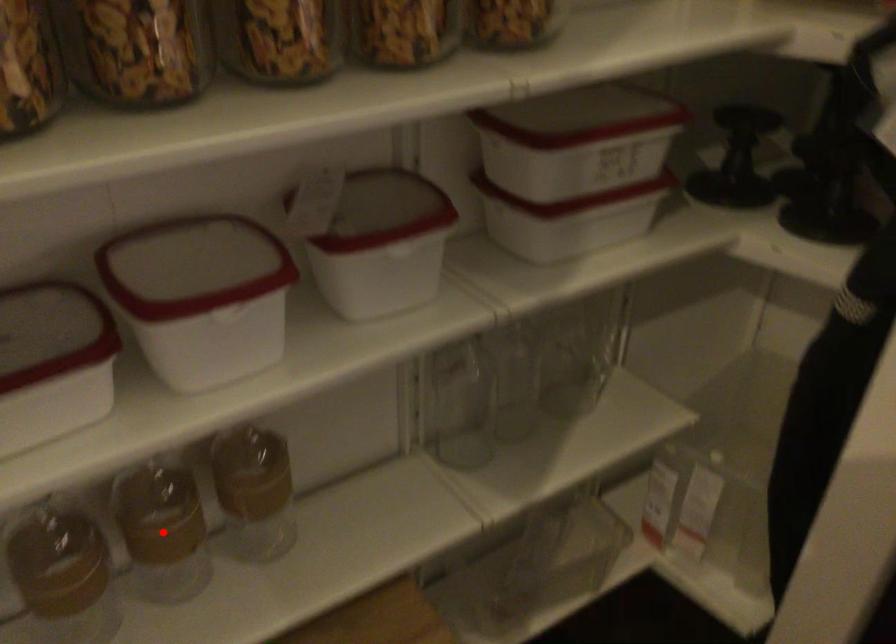
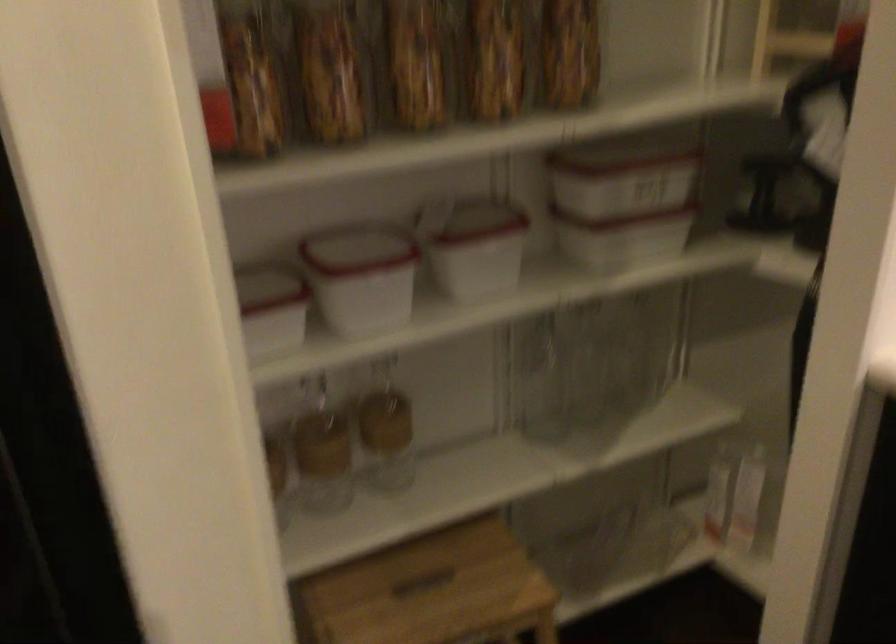
Locate, in the second image, the point that corresponds to the highlighted location in the first image.

(322, 451)